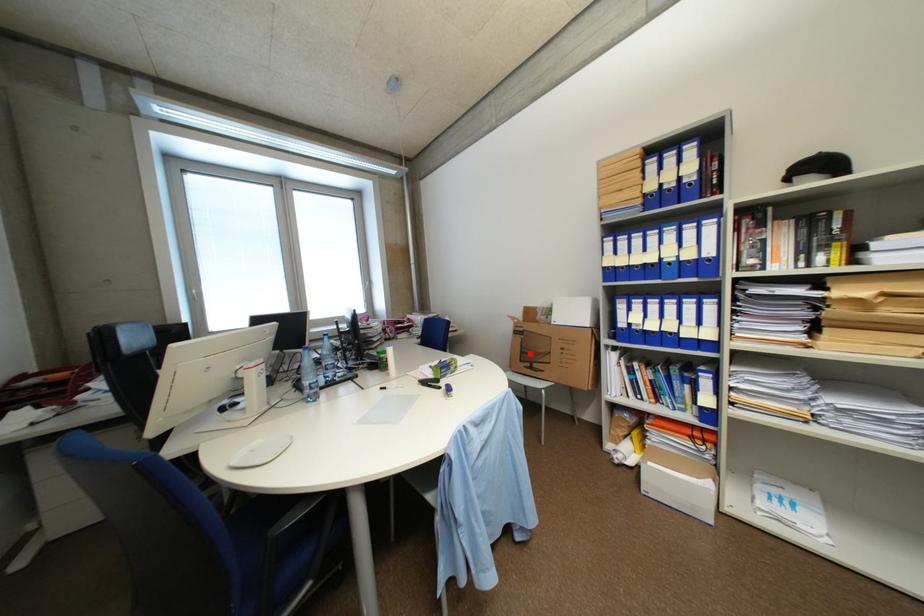
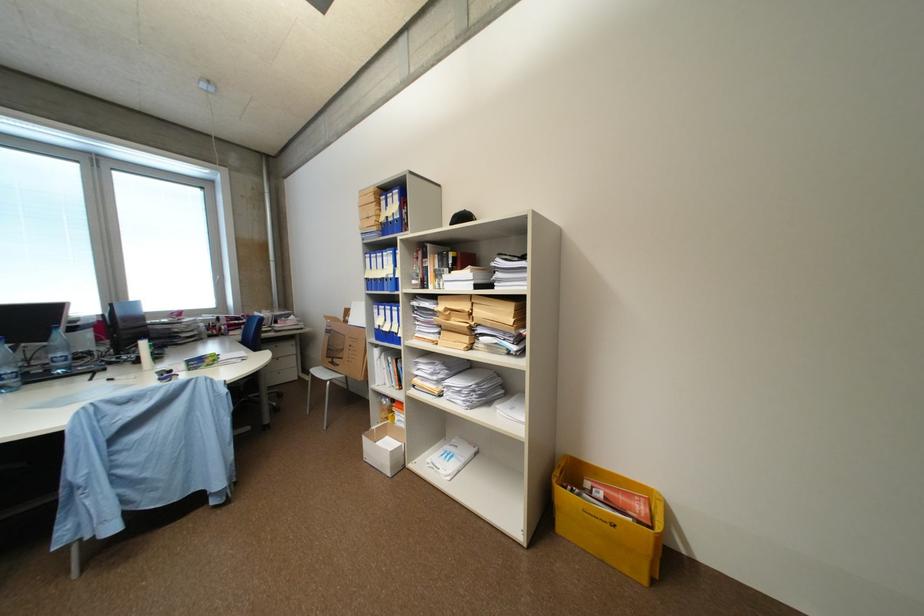
In the second image, find the point that corresponds to the highlighted location in the first image.

(336, 350)